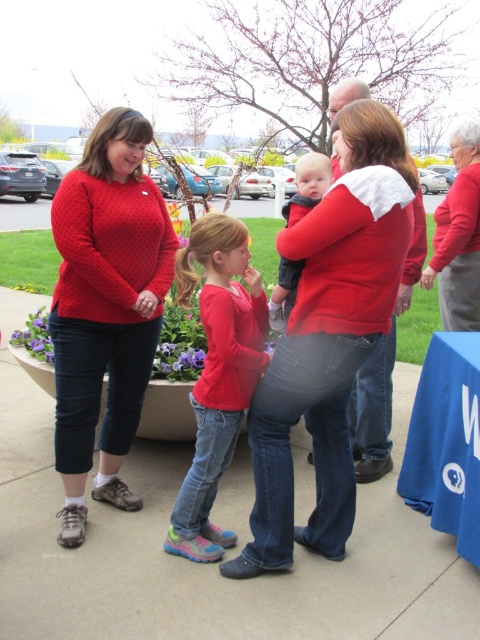
Question: Which of the following is the farthest from the observer?

Choices:
 (A) soft gray knit sweater at center
 (B) knitted red sweater at left

Answer: (A)

Question: Is matte red shirt at center in front of matte red sweater at center?

Choices:
 (A) no
 (B) yes

Answer: (A)

Question: Is knitted red sweater at left positioned at the back of matte red sweater at center?

Choices:
 (A) no
 (B) yes

Answer: (B)

Question: Is matte red sweater at center to the left of matte red sweater at upper right from the viewer's perspective?

Choices:
 (A) no
 (B) yes

Answer: (B)

Question: Which of the following is the closest to the observer?

Choices:
 (A) (379, 472)
 (B) (199, 236)
 (C) (441, 202)
 (D) (284, 307)

Answer: (B)

Question: Which object is closer to the camera taking this photo?

Choices:
 (A) matte red sweater at center
 (B) matte red shirt at center
 (C) matte red sweater at upper right
 (D) knitted red sweater at left

Answer: (A)